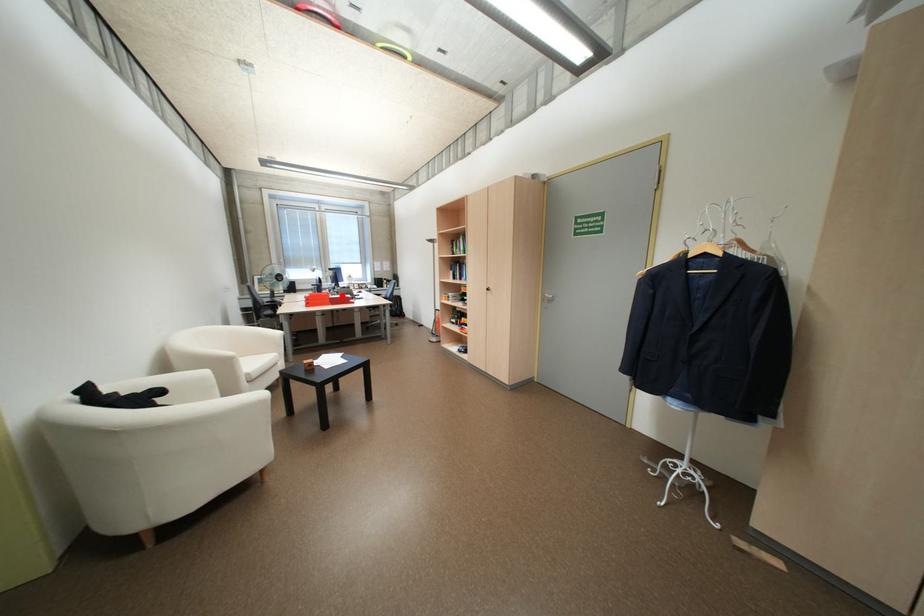
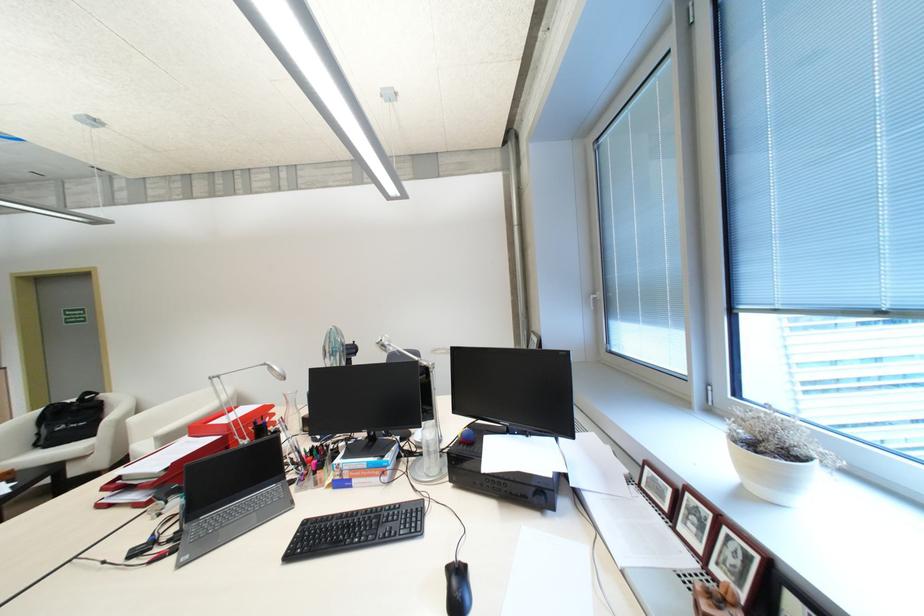
In the second image, find the point that corresponds to the highlighted location in the first image.

(224, 439)